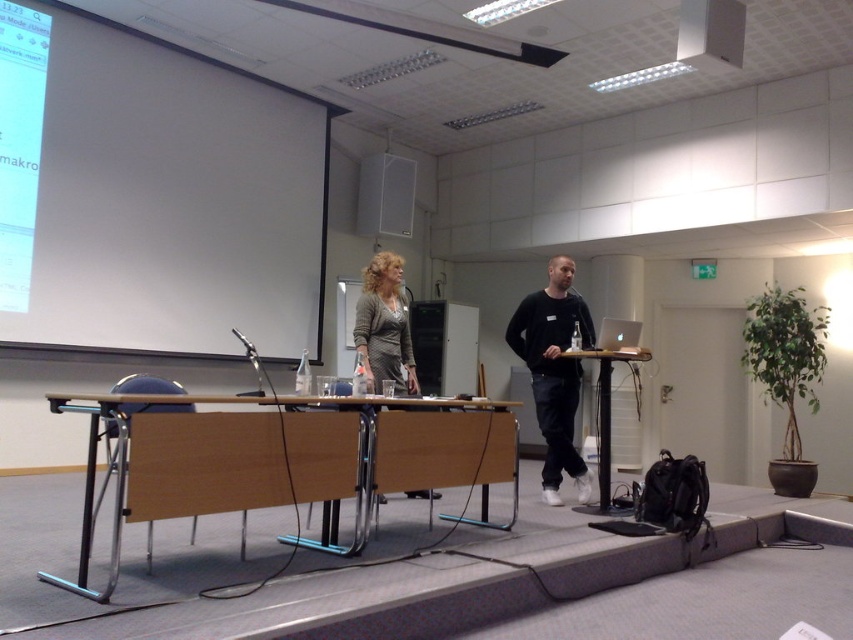
Can you confirm if black matte shirt at center is shorter than matte gray sweater at center?

Incorrect, black matte shirt at center's height does not fall short of matte gray sweater at center's.

Describe the element at coordinates (554, 371) in the screenshot. This screenshot has height=640, width=853. I see `black matte shirt at center` at that location.

This screenshot has width=853, height=640. I want to click on black matte shirt at center, so click(x=554, y=371).

Between wooden at center and black matte shirt at center, which one appears on the left side from the viewer's perspective?

wooden at center

Can you confirm if wooden at center is thinner than black matte shirt at center?

No.

Does point (129, 483) lie in front of point (556, 428)?

Yes, point (129, 483) is in front of point (556, 428).

Where is `wooden at center`? This screenshot has height=640, width=853. wooden at center is located at coordinates (308, 456).

How far apart are wooden at center and metallic silver speaker at upper center?

wooden at center is 4.31 meters from metallic silver speaker at upper center.

Is wooden at center thinner than metallic silver speaker at upper center?

No, wooden at center is not thinner than metallic silver speaker at upper center.

Does point (187, 497) come in front of point (376, 161)?

Yes.

You are a GUI agent. You are given a task and a screenshot of the screen. Output one action in this format:
    pyautogui.click(x=<x>, y=<y>)
    Task: Click on the wooden at center
    This screenshot has width=853, height=640.
    Given the screenshot: What is the action you would take?
    pyautogui.click(x=308, y=456)